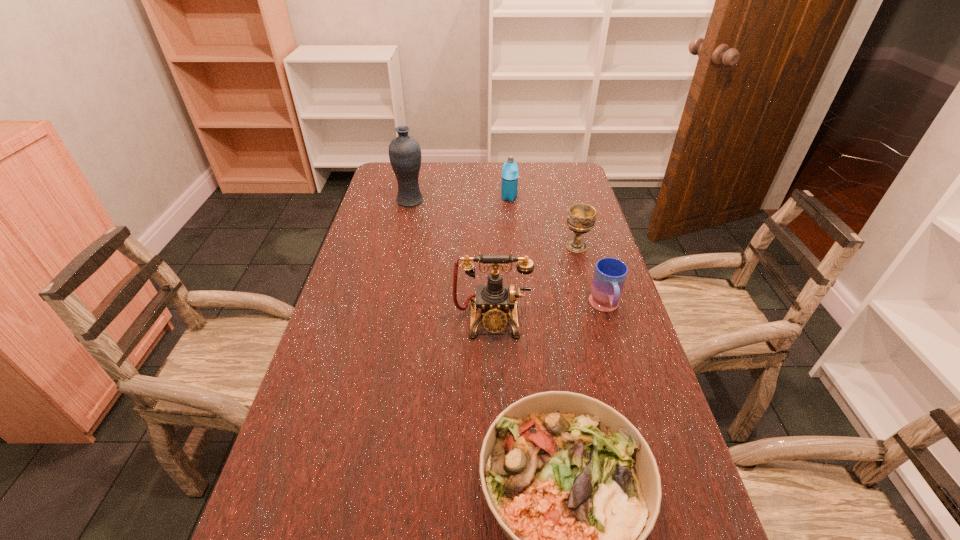
Identify the location of object identified as the third closest to the vase. The width and height of the screenshot is (960, 540). (581, 218).

You are a GUI agent. You are given a task and a screenshot of the screen. Output one action in this format:
    pyautogui.click(x=<x>, y=<y>)
    Task: Click on the object that can be found as the third closest to the chalice
    Image resolution: width=960 pixels, height=540 pixels.
    Given the screenshot: What is the action you would take?
    pyautogui.click(x=509, y=185)

I want to click on vacant region that satisfies the following two spatial constraints: 1. on the front side of the leftmost object; 2. on the left side of the third farthest object, so click(x=400, y=247).